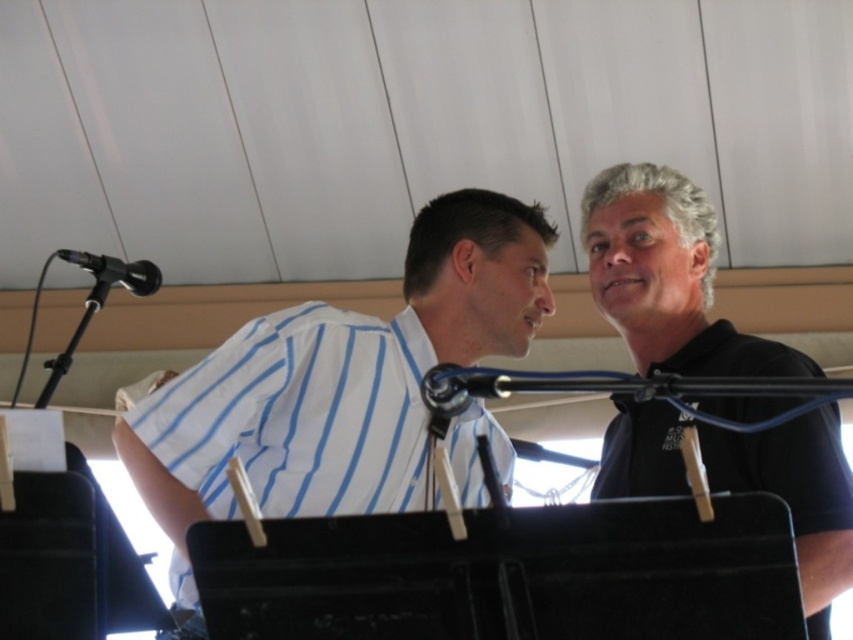
In the scene shown: Who is more distant from viewer, (480, 292) or (138, 288)?

The point (138, 288) is more distant.

Who is more forward, (323, 470) or (94, 262)?

Point (323, 470)

At what (x,y) coordinates should I click in order to perform the action: click on white striped shirt at center. Please return your answer as a coordinate pair (x, y). The image size is (853, 640). Looking at the image, I should click on (339, 381).

Which of these two, white striped shirt at center or black matte shirt at upper right, stands taller?

black matte shirt at upper right

Does point (402, 346) come in front of point (694, 305)?

Yes, it is.

Locate an element on the screen. This screenshot has width=853, height=640. white striped shirt at center is located at coordinates tap(339, 381).

Between black matte shirt at upper right and black metallic microphone at upper left, which one appears on the right side from the viewer's perspective?

From the viewer's perspective, black matte shirt at upper right appears more on the right side.

Can you confirm if black matte shirt at upper right is smaller than black metallic microphone at upper left?

Incorrect, black matte shirt at upper right is not smaller in size than black metallic microphone at upper left.

Which is in front, point (751, 483) or point (102, 256)?

Point (751, 483) is more forward.

Image resolution: width=853 pixels, height=640 pixels. Identify the location of black matte shirt at upper right. (666, 276).